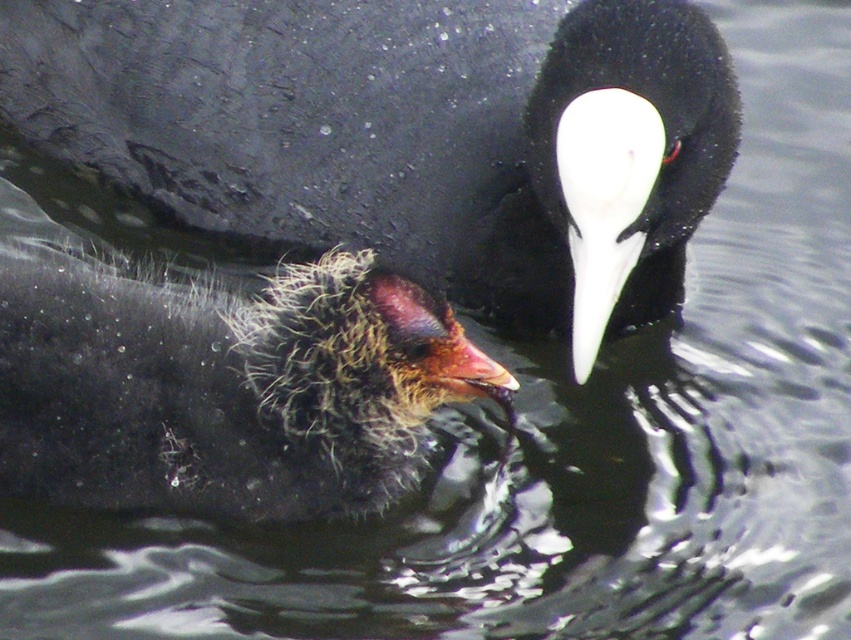
Question: Which of the following is the closest to the observer?

Choices:
 (A) white matte beak at center
 (B) fluffy downy chick at center
 (C) smooth red beak at center
 (D) white glossy beak at center

Answer: (A)

Question: Which point appears closest to the camera in this image?

Choices:
 (A) (586, 364)
 (B) (484, 368)

Answer: (B)

Question: Observing the image, what is the correct spatial positioning of fluffy downy chick at center in reference to white glossy beak at center?

Choices:
 (A) above
 (B) below

Answer: (B)

Question: Is white glossy beak at center above smooth red beak at center?

Choices:
 (A) yes
 (B) no

Answer: (A)

Question: Which point appears closest to the camera in this image?

Choices:
 (A) (489, 371)
 (B) (684, 61)
 (C) (66, 333)
 (D) (607, 260)

Answer: (C)

Question: Can you confirm if white matte beak at center is thinner than white glossy beak at center?

Choices:
 (A) yes
 (B) no

Answer: (B)